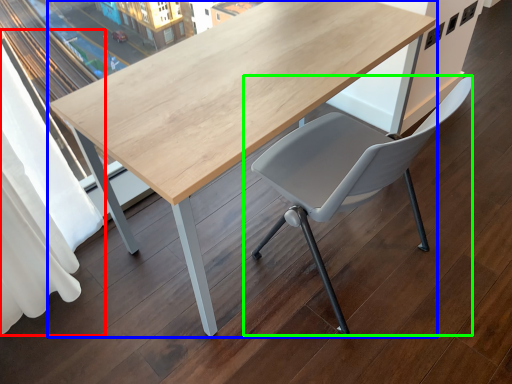
Question: Considering the real-world distances, which object is farthest from curtain (highlighted by a red box)? table (highlighted by a blue box) or chair (highlighted by a green box)?

Choices:
 (A) table
 (B) chair

Answer: (B)